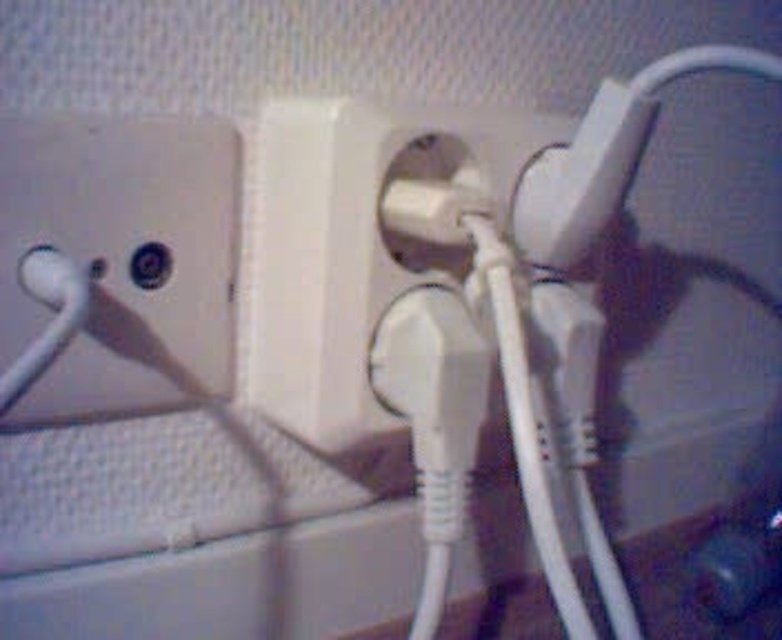
You are an electrician inspecting a wall with two white plastic outlets. You need to connect a new device to the outlet that is on the right side. Which outlet should you choose between the white plastic outlet at upper left and the white plastic outlet at center?

The white plastic outlet at center is on the right side because the white plastic outlet at upper left is to the left of it.